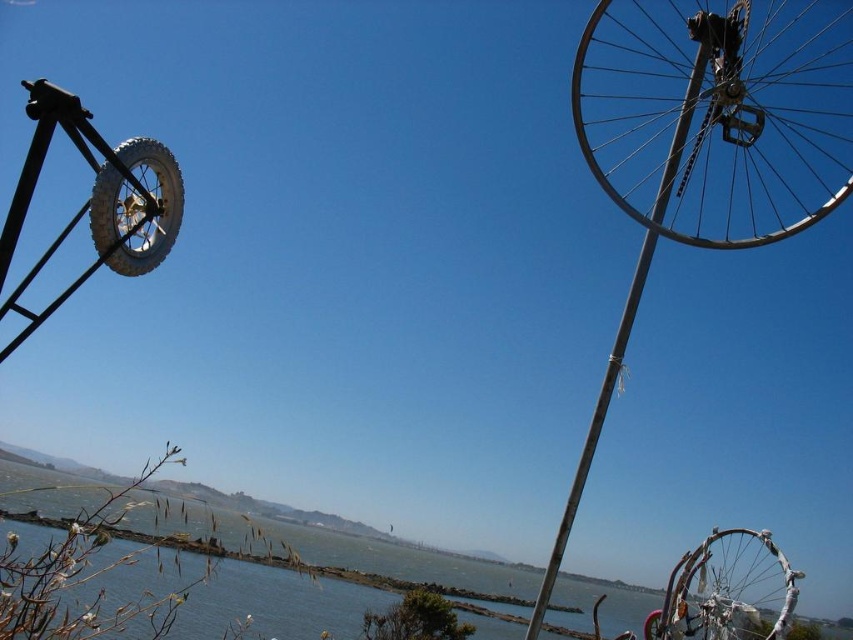
You are standing at the center of the artistic installation with bicycle wheels mounted on poles. You want to take a photo of the clear blue water at lower center. In which direction should you point your camera?

You should point your camera towards the lower center direction to capture the clear blue water at lower center located at point coordinates of (x=329, y=547).